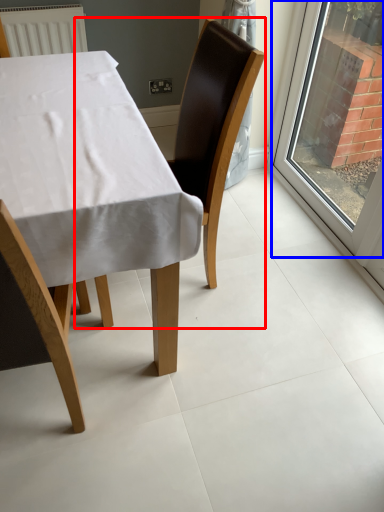
Question: Among these objects, which one is farthest to the camera, chair (highlighted by a red box) or window (highlighted by a blue box)?

Choices:
 (A) chair
 (B) window

Answer: (B)